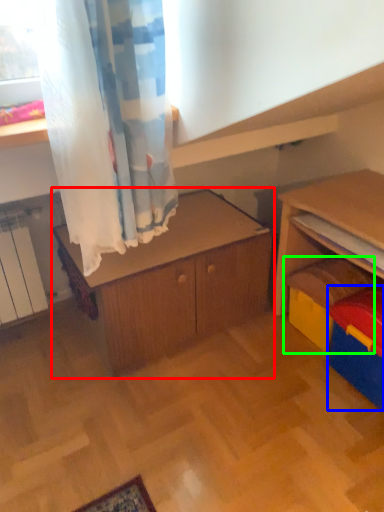
Question: Estimate the real-world distances between objects in this image. Which object is farther from cabinetry (highlighted by a red box), storage box (highlighted by a blue box) or toy (highlighted by a green box)?

Choices:
 (A) storage box
 (B) toy

Answer: (A)